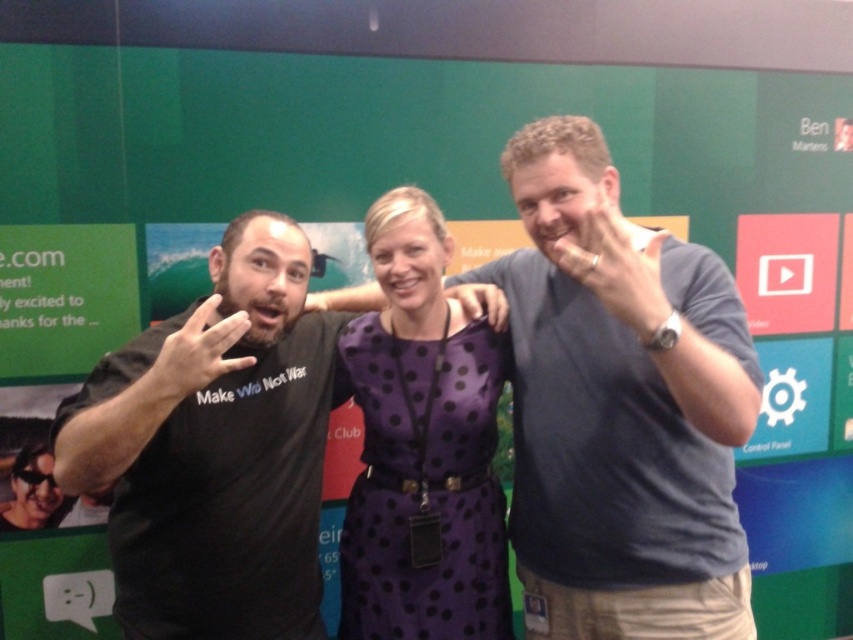
Is point (241, 486) positioned before point (650, 300)?

No, (241, 486) is behind (650, 300).

This screenshot has width=853, height=640. What are the coordinates of `black matte t-shirt at left` in the screenshot? It's located at (215, 449).

Between point (300, 305) and point (627, 244), which one is positioned behind?

Positioned behind is point (300, 305).

What are the coordinates of `black matte t-shirt at left` in the screenshot? It's located at (215, 449).

Who is positioned more to the right, dark blue shirt at center or matte black hand at left?

dark blue shirt at center is more to the right.

Does point (581, 557) come behind point (180, 387)?

Yes, it is.

Locate an element on the screen. This screenshot has width=853, height=640. dark blue shirt at center is located at coordinates (619, 406).

Can you confirm if matte black hand at left is positioned to the left of matte black t-shirt at left?

In fact, matte black hand at left is to the right of matte black t-shirt at left.

Is point (202, 300) positioned after point (50, 493)?

That is False.

Is point (189, 392) positioned after point (7, 506)?

No, (189, 392) is closer to viewer.

You are a GUI agent. You are given a task and a screenshot of the screen. Output one action in this format:
    pyautogui.click(x=<x>, y=<y>)
    Task: Click on the matte black hand at left
    
    Given the screenshot: What is the action you would take?
    pyautogui.click(x=196, y=353)